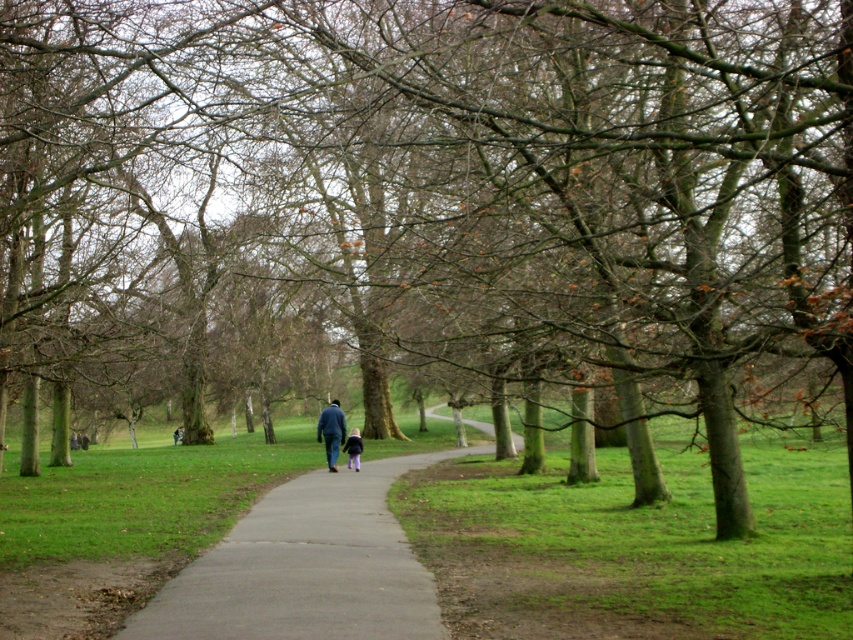
Does dark blue jeans at center have a smaller size compared to dark blue jacket at center?

Correct, dark blue jeans at center occupies less space than dark blue jacket at center.

Who is more distant from viewer, (345,445) or (181,426)?

Positioned behind is point (181,426).

Locate an element on the screen. This screenshot has height=640, width=853. dark blue jeans at center is located at coordinates (352, 448).

Which is more to the right, blue fabric jacket at center or dark blue jeans at center?

Positioned to the right is dark blue jeans at center.

Does point (339, 440) lie in front of point (358, 461)?

Yes, point (339, 440) is closer to viewer.

Consider the image. Who is more forward, (329, 428) or (357, 440)?

Point (329, 428) is more forward.

Identify the location of blue fabric jacket at center. coord(331,432).

Who is more distant from viewer, (392, 577) or (177, 438)?

The point (177, 438) is more distant.

Can you confirm if gray concrete pavement at center is bigger than dark blue jacket at center?

Correct, gray concrete pavement at center is larger in size than dark blue jacket at center.

Locate an element on the screen. This screenshot has width=853, height=640. gray concrete pavement at center is located at coordinates (306, 566).

You are a GUI agent. You are given a task and a screenshot of the screen. Output one action in this format:
    pyautogui.click(x=<x>, y=<y>)
    Task: Click on the gray concrete pavement at center
    Image resolution: width=853 pixels, height=640 pixels.
    Given the screenshot: What is the action you would take?
    [306, 566]